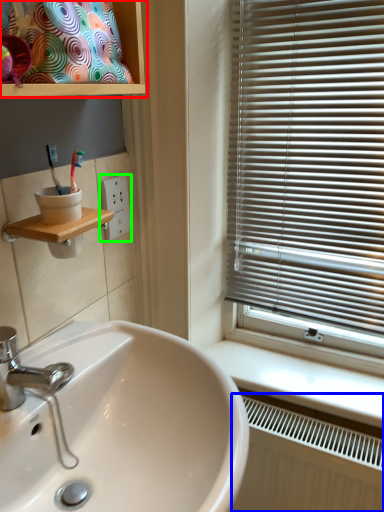
Question: Considering the real-world distances, which object is farthest from cabinet (highlighted by a red box)? radiator (highlighted by a blue box) or electric outlet (highlighted by a green box)?

Choices:
 (A) radiator
 (B) electric outlet

Answer: (A)